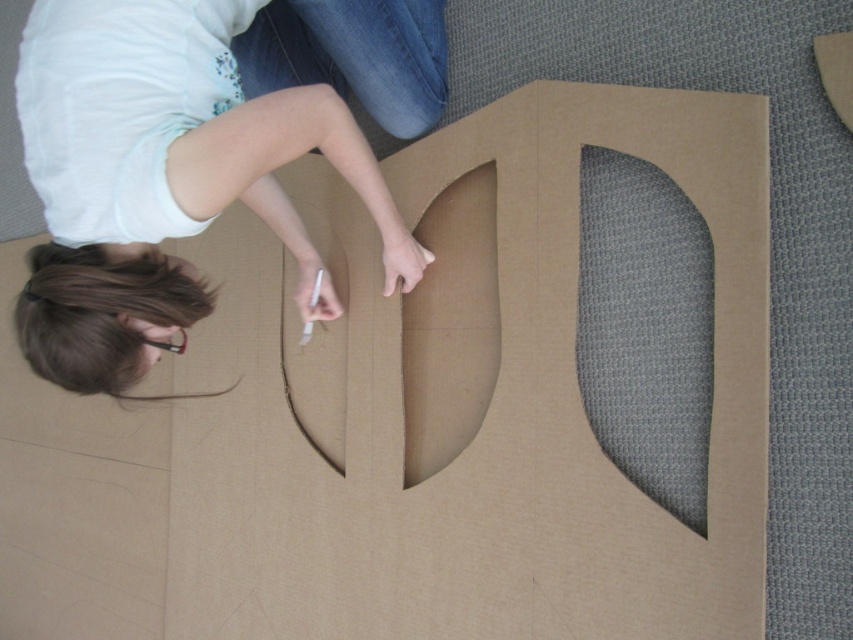
Question: Among these points, which one is nearest to the camera?

Choices:
 (A) [248, 428]
 (B) [120, 282]

Answer: (B)

Question: Does brown cardboard at center have a lesser width compared to matte brown hair at upper left?

Choices:
 (A) yes
 (B) no

Answer: (B)

Question: Does brown cardboard at center have a greater width compared to matte brown hair at upper left?

Choices:
 (A) yes
 (B) no

Answer: (A)

Question: In this image, where is brown cardboard at center located relative to matte brown hair at upper left?

Choices:
 (A) left
 (B) right

Answer: (B)